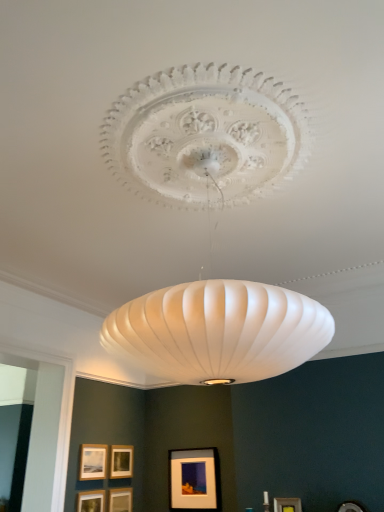
Question: From a real-world perspective, is matte black picture frame at lower center, marked as the 2th picture frame in a right-to-left arrangement, under matte gold picture frame at lower left, which appears as the sixth picture frame when viewed from the right?

Choices:
 (A) yes
 (B) no

Answer: (A)

Question: Considering the relative sizes of matte black picture frame at lower center, marked as the 2th picture frame in a right-to-left arrangement, and matte gold picture frame at lower left, which is the first picture frame from left to right, in the image provided, is matte black picture frame at lower center, marked as the 2th picture frame in a right-to-left arrangement, taller than matte gold picture frame at lower left, which is the first picture frame from left to right,?

Choices:
 (A) yes
 (B) no

Answer: (A)

Question: From a real-world perspective, is matte black picture frame at lower center, marked as the fifth picture frame in a left-to-right arrangement, physically above matte gold picture frame at lower left, which is the first picture frame from left to right?

Choices:
 (A) yes
 (B) no

Answer: (B)

Question: Would you say matte black picture frame at lower center, marked as the fifth picture frame in a left-to-right arrangement, is a long distance from matte gold picture frame at lower left, which is the first picture frame from left to right?

Choices:
 (A) yes
 (B) no

Answer: (B)

Question: Is the depth of matte black picture frame at lower center, marked as the 2th picture frame in a right-to-left arrangement, greater than that of matte gold picture frame at lower left, which appears as the sixth picture frame when viewed from the right?

Choices:
 (A) no
 (B) yes

Answer: (B)

Question: Is matte black picture frame at lower center, marked as the fifth picture frame in a left-to-right arrangement, wider than matte gold picture frame at lower left, which is the first picture frame from left to right?

Choices:
 (A) no
 (B) yes

Answer: (B)

Question: Would you say matte gold picture frame at center, which ranks as the 3th picture frame in left-to-right order, is part of matte gold picture frame at lower left, which appears as the sixth picture frame when viewed from the right,'s contents?

Choices:
 (A) no
 (B) yes

Answer: (A)

Question: Is the position of matte gold picture frame at lower left, which is the first picture frame from left to right, less distant than that of matte gold picture frame at center, which ranks as the 3th picture frame in left-to-right order?

Choices:
 (A) no
 (B) yes

Answer: (B)

Question: Could you tell me if matte gold picture frame at lower left, which appears as the sixth picture frame when viewed from the right, is facing matte gold picture frame at center, which ranks as the 3th picture frame in left-to-right order?

Choices:
 (A) yes
 (B) no

Answer: (B)

Question: Is matte gold picture frame at lower left, which is the first picture frame from left to right, bigger than matte gold picture frame at center, acting as the 4th picture frame starting from the right?

Choices:
 (A) yes
 (B) no

Answer: (A)

Question: Does matte gold picture frame at lower left, which is the first picture frame from left to right, have a lesser width compared to matte gold picture frame at center, which ranks as the 3th picture frame in left-to-right order?

Choices:
 (A) no
 (B) yes

Answer: (A)

Question: Is matte gold picture frame at lower left, which is the first picture frame from left to right, at the right side of matte gold picture frame at center, acting as the 4th picture frame starting from the right?

Choices:
 (A) no
 (B) yes

Answer: (A)

Question: Is matte gold picture frame at lower center, which is counted as the second picture frame, starting from the left, taller than matte gold picture frame at center, acting as the 4th picture frame starting from the right?

Choices:
 (A) yes
 (B) no

Answer: (A)